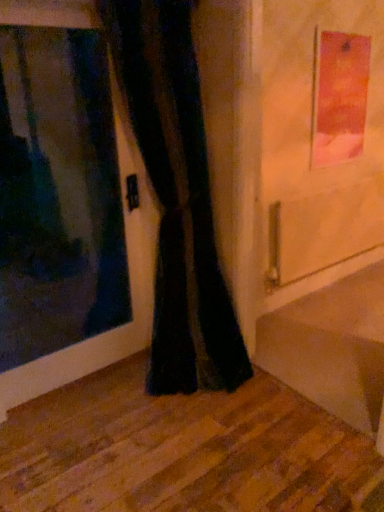
Where is `vacant space situated above pink paper at upper right (from a real-world perspective)`? Image resolution: width=384 pixels, height=512 pixels. vacant space situated above pink paper at upper right (from a real-world perspective) is located at coordinates (350, 29).